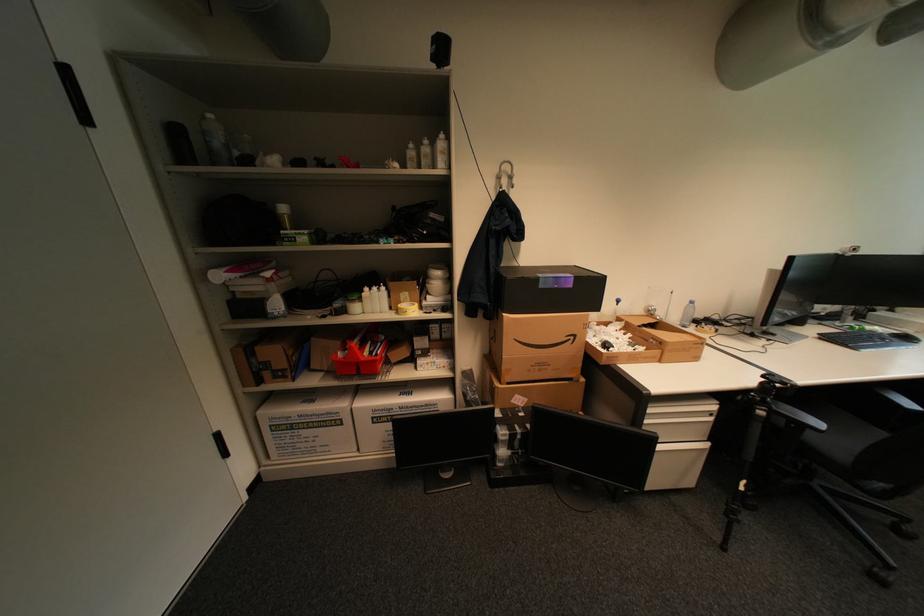
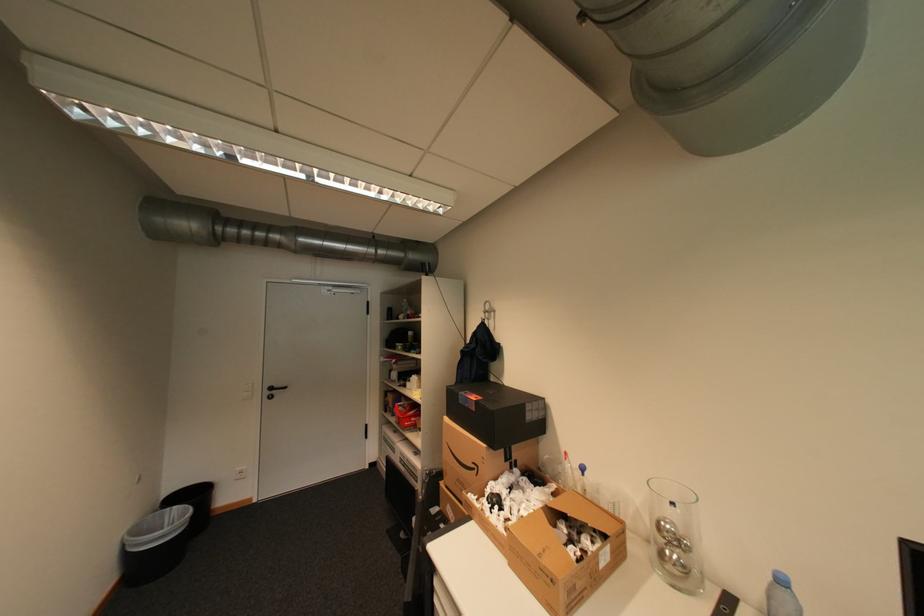
Question: I am providing you with two images of the same scene from different viewpoints. Which of the following objects are not visible in image2?

Choices:
 (A) cardboard box
 (B) black door handle
 (C) black cardboard box
 (D) none of these

Answer: (D)